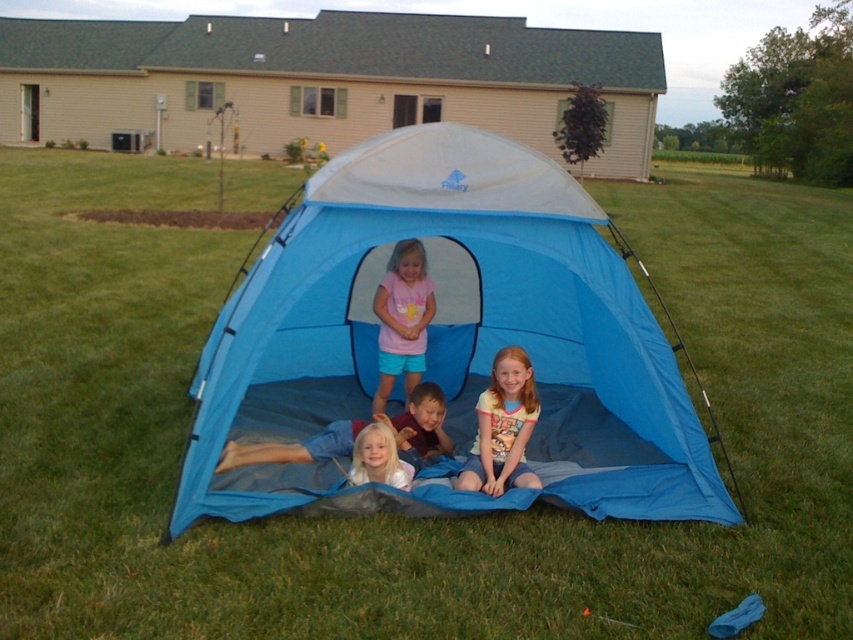
You are a photographer trying to capture the best shot of the blue fabric tent at center. You want to position your camera exactly at point (451, 337). What will you find there?

At point (451, 337) lies the blue fabric tent at center, so placing the camera there would position it directly at the center of the tent.

You are a photographer trying to capture a clear shot of the blonde hair at center without the blue fabric tent at center blocking the view. Is this possible given their positions?

The blue fabric tent at center is closer to the viewer than the blonde hair at center, so the tent would block the view of the blonde hair at center unless moved or adjusted.